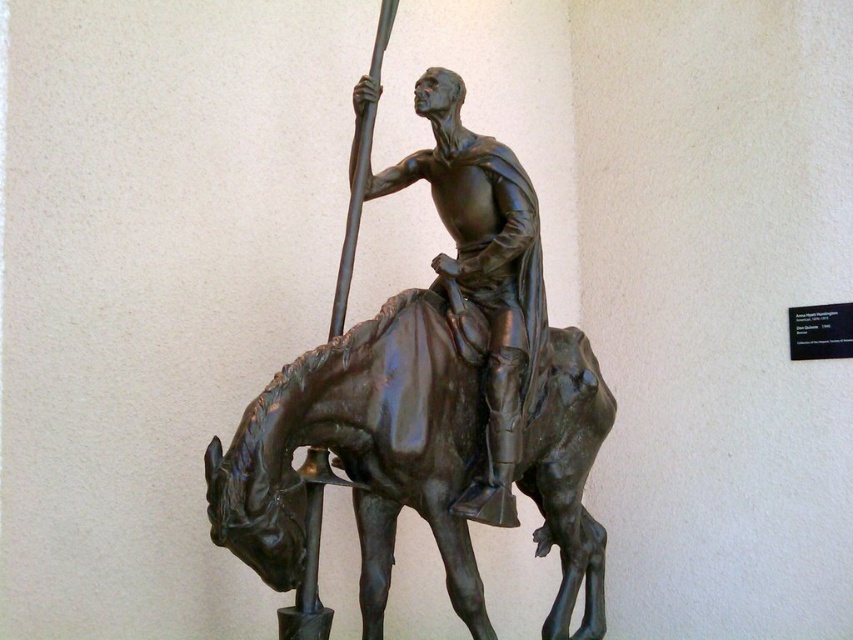
You are standing in front of a bronze sculpture of a knight on horseback. The scene includes a shiny bronze horse at center and a bronze statue at center. Which object is closer to you?

The shiny bronze horse at center is closer to you because it is positioned in front of the bronze statue at center.

You are an art conservator examining the sculpture. You notice that the shiny bronze horse at center and the bronze statue at center are positioned in a specific way. Which object is located to the left of the other?

The shiny bronze horse at center is positioned on the left side of bronze statue at center.